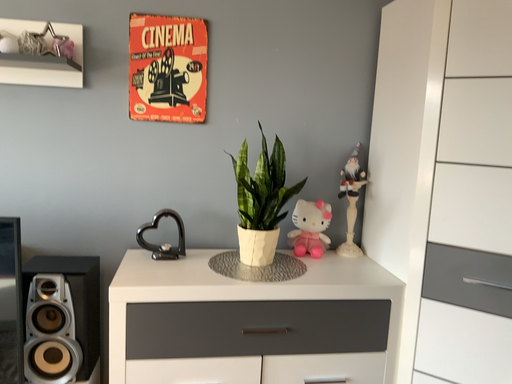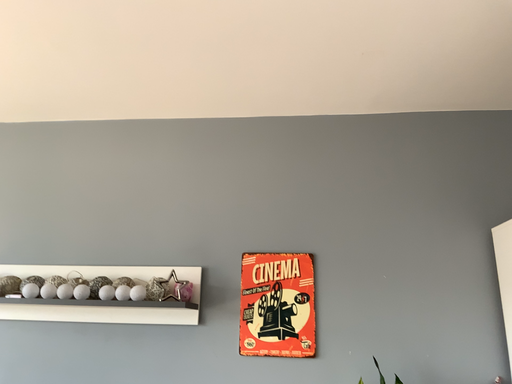
Question: How did the camera likely rotate when shooting the video?

Choices:
 (A) rotated left
 (B) rotated right

Answer: (A)